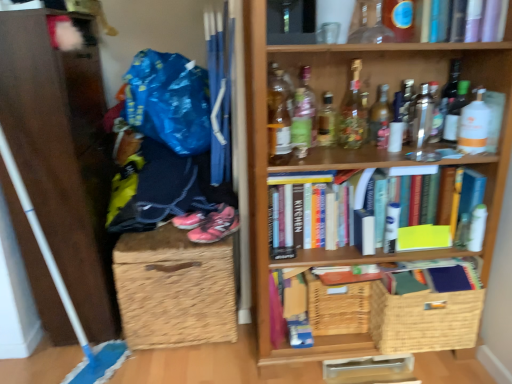
Question: Which direction should I rotate to look at translucent glass bottle at upper center, the 6th bottle from the right, — up or down?

Choices:
 (A) down
 (B) up

Answer: (B)

Question: Does translucent glass bottle at upper center, positioned as the sixth bottle in left-to-right order, have a lesser width compared to woven brown basket at lower right, the first basket from the right?

Choices:
 (A) no
 (B) yes

Answer: (B)

Question: Is translucent glass bottle at upper center, the 6th bottle from the right, positioned behind woven brown basket at lower right, the second basket when ordered from left to right?

Choices:
 (A) yes
 (B) no

Answer: (A)

Question: From the image's perspective, is translucent glass bottle at upper center, the 6th bottle from the right, beneath woven brown basket at lower right, the second basket when ordered from left to right?

Choices:
 (A) yes
 (B) no

Answer: (B)

Question: Is translucent glass bottle at upper center, positioned as the sixth bottle in left-to-right order, shorter than woven brown basket at lower right, the first basket from the right?

Choices:
 (A) no
 (B) yes

Answer: (B)

Question: Can you confirm if translucent glass bottle at upper center, positioned as the sixth bottle in left-to-right order, is positioned to the right of woven brown basket at lower right, the second basket when ordered from left to right?

Choices:
 (A) yes
 (B) no

Answer: (B)

Question: Is woven brown basket at lower right, the first basket from the right, surrounded by translucent glass bottle at upper center, positioned as the sixth bottle in left-to-right order?

Choices:
 (A) no
 (B) yes

Answer: (A)

Question: Is there a large distance between woven brown basket at lower right, the second basket when ordered from left to right, and cardboard box at center, arranged as the 4th book when viewed from the top?

Choices:
 (A) yes
 (B) no

Answer: (B)

Question: Can you confirm if woven brown basket at lower right, the second basket when ordered from left to right, is positioned to the right of cardboard box at center, the first book ordered from the bottom?

Choices:
 (A) no
 (B) yes

Answer: (B)

Question: From a real-world perspective, is woven brown basket at lower right, the first basket from the right, positioned over cardboard box at center, the first book ordered from the bottom, based on gravity?

Choices:
 (A) yes
 (B) no

Answer: (B)

Question: Is woven brown basket at lower right, the first basket from the right, at the left side of cardboard box at center, the first book ordered from the bottom?

Choices:
 (A) no
 (B) yes

Answer: (A)

Question: Is woven brown basket at lower right, the second basket when ordered from left to right, not inside cardboard box at center, arranged as the 4th book when viewed from the top?

Choices:
 (A) yes
 (B) no

Answer: (A)

Question: Is woven brown basket at lower right, the first basket from the right, shorter than cardboard box at center, the first book ordered from the bottom?

Choices:
 (A) no
 (B) yes

Answer: (B)

Question: Is brown wicker basket at lower left smaller than translucent glass bottle at center, which is the fourth bottle from left to right?

Choices:
 (A) no
 (B) yes

Answer: (A)